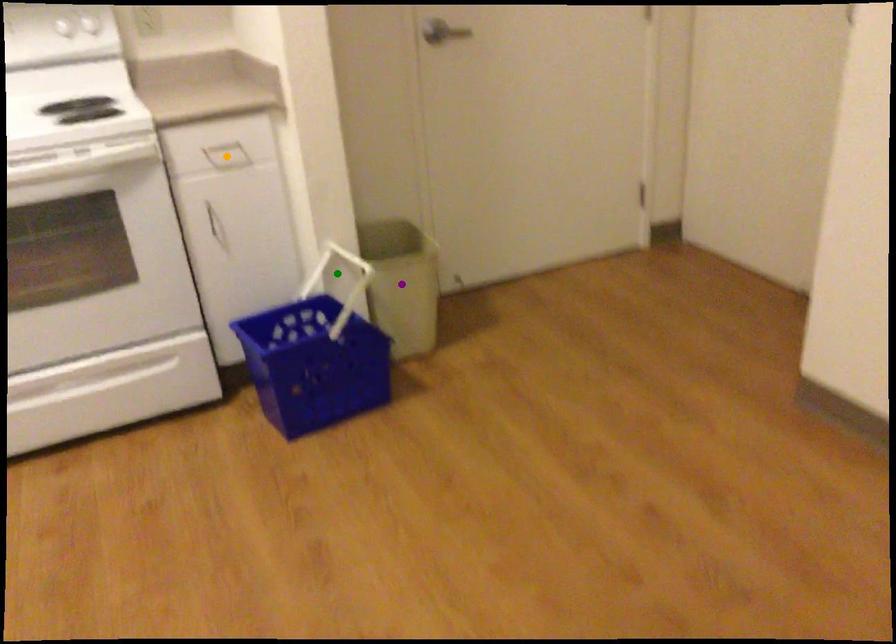
Order these from farthest to nearest:
orange point | green point | purple point

purple point, green point, orange point